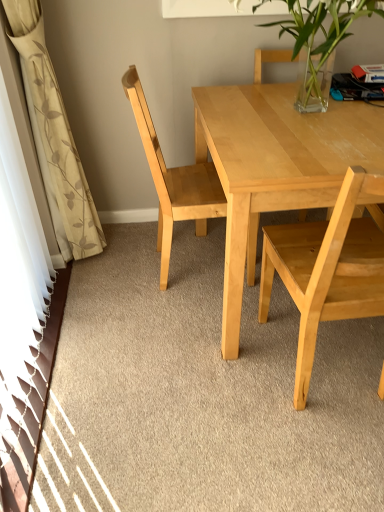
Where is `vacant area that lies in front of light wood chair at right, which appears as the second chair when viewed from the left`? This screenshot has width=384, height=512. vacant area that lies in front of light wood chair at right, which appears as the second chair when viewed from the left is located at coordinates (312, 460).